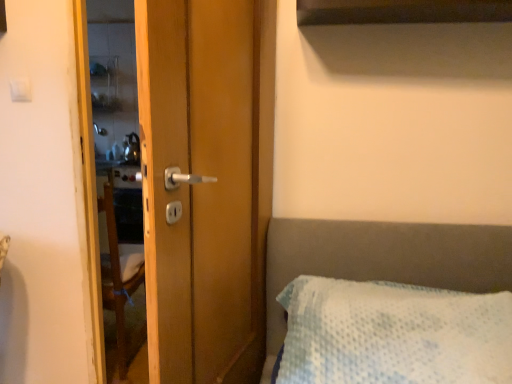
Question: Does white plastic light switch at upper left have a greater width compared to wooden door handle at center?

Choices:
 (A) yes
 (B) no

Answer: (B)

Question: Can you see white plastic light switch at upper left touching wooden door handle at center?

Choices:
 (A) yes
 (B) no

Answer: (B)

Question: Can you confirm if white plastic light switch at upper left is bigger than wooden door handle at center?

Choices:
 (A) no
 (B) yes

Answer: (A)

Question: Does white plastic light switch at upper left lie behind wooden door handle at center?

Choices:
 (A) yes
 (B) no

Answer: (A)

Question: Is wooden door handle at center a part of white plastic light switch at upper left?

Choices:
 (A) no
 (B) yes

Answer: (A)

Question: Considering the relative sizes of white plastic light switch at upper left and wooden door handle at center in the image provided, is white plastic light switch at upper left shorter than wooden door handle at center?

Choices:
 (A) yes
 (B) no

Answer: (A)

Question: Is wooden door handle at center looking in the opposite direction of white plastic light switch at upper left?

Choices:
 (A) yes
 (B) no

Answer: (B)

Question: Could you tell me if wooden door handle at center is facing white plastic light switch at upper left?

Choices:
 (A) no
 (B) yes

Answer: (B)

Question: Does wooden door handle at center have a greater width compared to white plastic light switch at upper left?

Choices:
 (A) yes
 (B) no

Answer: (A)

Question: Considering the relative sizes of wooden door handle at center and white plastic light switch at upper left in the image provided, is wooden door handle at center bigger than white plastic light switch at upper left?

Choices:
 (A) no
 (B) yes

Answer: (B)

Question: Is wooden door handle at center at the left side of white plastic light switch at upper left?

Choices:
 (A) yes
 (B) no

Answer: (B)

Question: Is wooden door handle at center not within white plastic light switch at upper left?

Choices:
 (A) no
 (B) yes

Answer: (B)

Question: From the image's perspective, is white plastic light switch at upper left located above or below wooden door handle at center?

Choices:
 (A) above
 (B) below

Answer: (A)